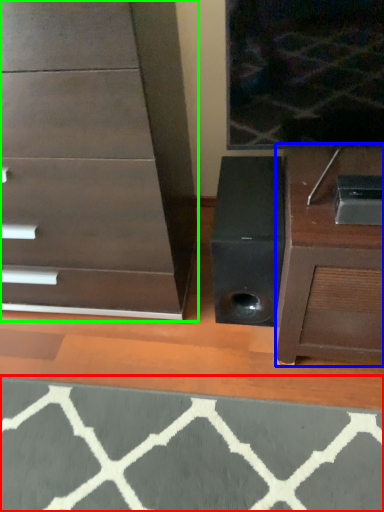
Question: Considering the real-world distances, which object is closest to doormat (highlighted by a red box)? furniture (highlighted by a blue box) or chest of drawers (highlighted by a green box).

Choices:
 (A) furniture
 (B) chest of drawers

Answer: (A)